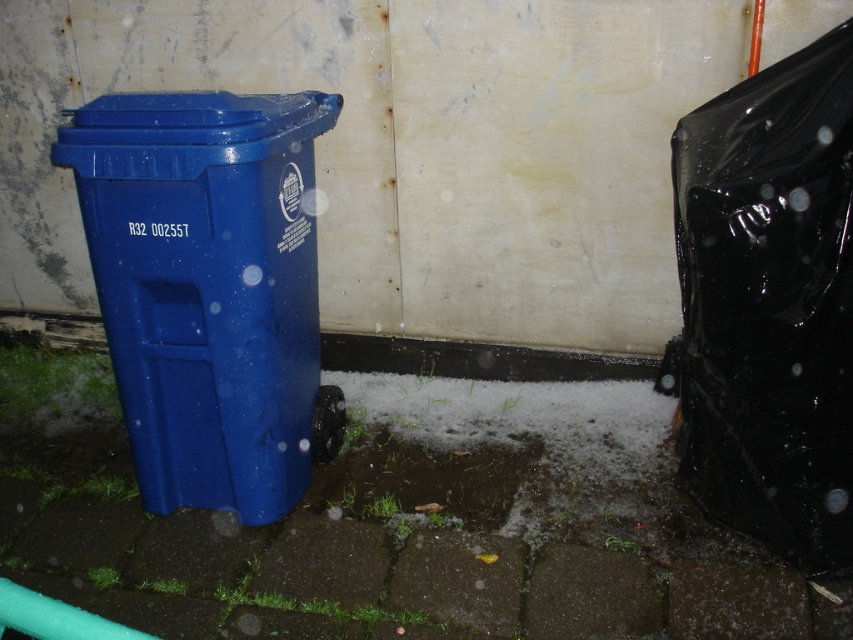
You are standing in a yard and see the matte plastic recycling bin at left. If you take two steps forward, will you be closer to it than 5 feet?

The matte plastic recycling bin at left is currently 6.66 feet away. Taking two steps forward would reduce the distance, but unless each step covers more than 0.83 feet, you would still be more than 5 feet away. Since typical steps are about 2.5 feet each, two steps would bring you to approximately 1.66 feet, which is closer than 5 feet. Therefore, yes, you would be within 5 feet.

Consider the image. What is located at the coordinates point [209,289] in the image?

The coordinates point [209,289] mark the location of the matte plastic recycling bin at left.